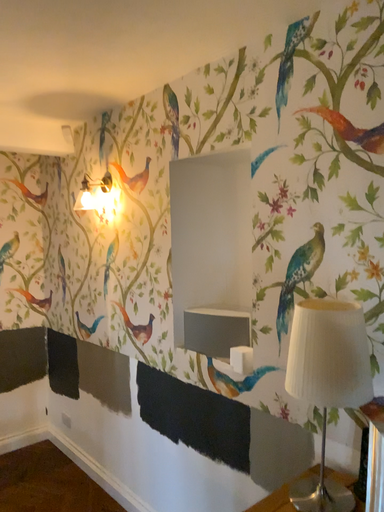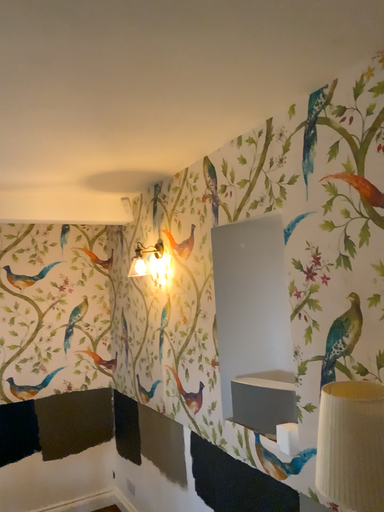
Question: Which way did the camera rotate in the video?

Choices:
 (A) rotated upward
 (B) rotated downward

Answer: (A)